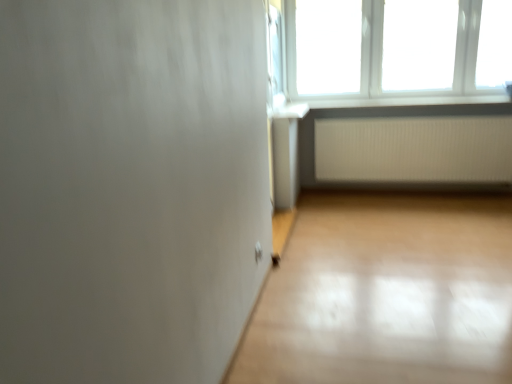
What do you see at coordinates (414, 149) in the screenshot? The width and height of the screenshot is (512, 384). I see `white ribbed radiator at lower right` at bounding box center [414, 149].

The height and width of the screenshot is (384, 512). I want to click on white plastic window at upper right, so click(x=375, y=49).

Considering the positions of objects white ribbed radiator at lower right and white plastic window sill at upper right in the image provided, who is behind, white ribbed radiator at lower right or white plastic window sill at upper right?

Positioned behind is white ribbed radiator at lower right.

Can you confirm if white ribbed radiator at lower right is thinner than white plastic window sill at upper right?

Yes.

Consider the image. How different are the orientations of white ribbed radiator at lower right and white plastic window sill at upper right in degrees?

There is a 1.09-degree angle between the facing directions of white ribbed radiator at lower right and white plastic window sill at upper right.

Which is more to the left, white ribbed radiator at lower right or white plastic window sill at upper right?

white plastic window sill at upper right is more to the left.

Would you say white ribbed radiator at lower right is to the left or to the right of white plastic window at upper right in the picture?

In the image, white ribbed radiator at lower right appears on the right side of white plastic window at upper right.

Is point (429, 147) closer to viewer compared to point (390, 60)?

Yes, it is in front of point (390, 60).

From the image's perspective, between white ribbed radiator at lower right and white plastic window at upper right, which one is located above?

white plastic window at upper right.

Is white ribbed radiator at lower right thinner than white plastic window at upper right?

Yes.

From the image's perspective, is white plastic window sill at upper right above or below white ribbed radiator at lower right?

white plastic window sill at upper right is situated higher than white ribbed radiator at lower right in the image.

Which of these two, white plastic window sill at upper right or white ribbed radiator at lower right, is smaller?

white plastic window sill at upper right.

Can you tell me how much white plastic window sill at upper right and white ribbed radiator at lower right differ in facing direction?

They differ by 1.09 degrees in their facing directions.

Does white plastic window at upper right have a lesser height compared to white plastic window sill at upper right?

No.

Between white plastic window at upper right and white plastic window sill at upper right, which one has larger width?

white plastic window sill at upper right is wider.

Which object is more forward, white plastic window at upper right or white plastic window sill at upper right?

white plastic window at upper right is in front.

The image size is (512, 384). Identify the location of window that is above the white ribbed radiator at lower right (from a real-world perspective). (375, 49).

In the scene shown: From the image's perspective, is white plastic window at upper right above or below white ribbed radiator at lower right?

white plastic window at upper right is situated higher than white ribbed radiator at lower right in the image.

Would you say white plastic window at upper right is inside or outside white ribbed radiator at lower right?

white plastic window at upper right is spatially situated outside white ribbed radiator at lower right.

Which object is positioned more to the right, white plastic window at upper right or white ribbed radiator at lower right?

From the viewer's perspective, white ribbed radiator at lower right appears more on the right side.

Is white plastic window sill at upper right to the left of white plastic window at upper right from the viewer's perspective?

No.

Image resolution: width=512 pixels, height=384 pixels. Identify the location of window in front of the white plastic window sill at upper right. (375, 49).

Considering the sizes of objects white plastic window sill at upper right and white plastic window at upper right in the image provided, who is taller, white plastic window sill at upper right or white plastic window at upper right?

With more height is white plastic window at upper right.

Locate an element on the screen. This screenshot has height=384, width=512. radiator lying behind the white plastic window sill at upper right is located at coordinates (414, 149).

Image resolution: width=512 pixels, height=384 pixels. I want to click on radiator on the right of white plastic window at upper right, so click(414, 149).

Which object lies nearer to the anchor point white ribbed radiator at lower right, white plastic window sill at upper right or white plastic window at upper right?

white plastic window sill at upper right.

From the image, which object appears to be farther from white ribbed radiator at lower right, white plastic window at upper right or white plastic window sill at upper right?

The object further to white ribbed radiator at lower right is white plastic window at upper right.

When comparing their distances from white plastic window at upper right, does white plastic window sill at upper right or white ribbed radiator at lower right seem further?

Answer: Among the two, white ribbed radiator at lower right is located further to white plastic window at upper right.

Considering their positions, is white plastic window at upper right positioned closer to white plastic window sill at upper right than white ribbed radiator at lower right?

Based on the image, white ribbed radiator at lower right appears to be nearer to white plastic window sill at upper right.

Looking at the image, which one is located closer to white plastic window at upper right, white ribbed radiator at lower right or white plastic window sill at upper right?

The object closer to white plastic window at upper right is white plastic window sill at upper right.

Based on their spatial positions, is white ribbed radiator at lower right or white plastic window at upper right closer to white plastic window sill at upper right?

white ribbed radiator at lower right.

Identify the location of window sill that lies between white plastic window at upper right and white ribbed radiator at lower right from top to bottom. This screenshot has width=512, height=384. (410, 107).